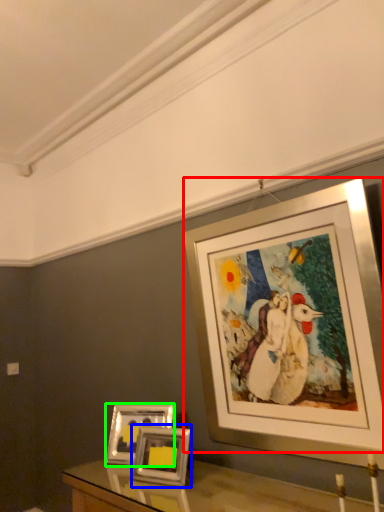
Question: Which is nearer to the picture frame (highlighted by a red box)? picture frame (highlighted by a blue box) or picture frame (highlighted by a green box).

Choices:
 (A) picture frame
 (B) picture frame

Answer: (A)